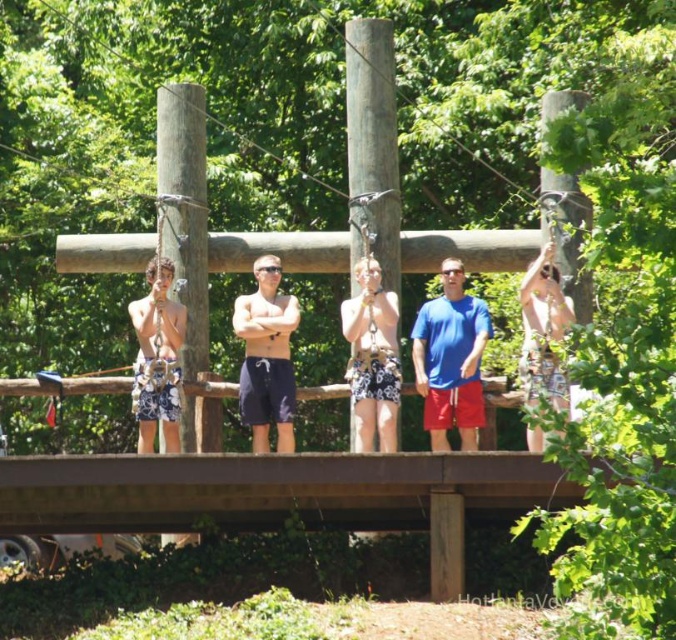
Question: Which point appears farthest from the camera in this image?

Choices:
 (A) (287, 301)
 (B) (174, 109)

Answer: (B)

Question: Which object is positioned farthest from the smooth wood pole at upper right?

Choices:
 (A) white cotton shorts at left
 (B) smooth wood pole at center
 (C) dark blue swim trunks at center
 (D) brown wood pole at left

Answer: (A)

Question: Is white cotton shorts at left closer to camera compared to camouflage shorts at right?

Choices:
 (A) yes
 (B) no

Answer: (B)

Question: Does blue fabric shirt at center appear on the right side of camouflage shorts at right?

Choices:
 (A) yes
 (B) no

Answer: (B)

Question: Is the position of blue fabric shirt at center less distant than that of white floral shorts at center?

Choices:
 (A) yes
 (B) no

Answer: (B)

Question: Which of these objects is positioned closest to the dark blue swim trunks at center?

Choices:
 (A) white floral shorts at center
 (B) smooth wood pole at center

Answer: (A)